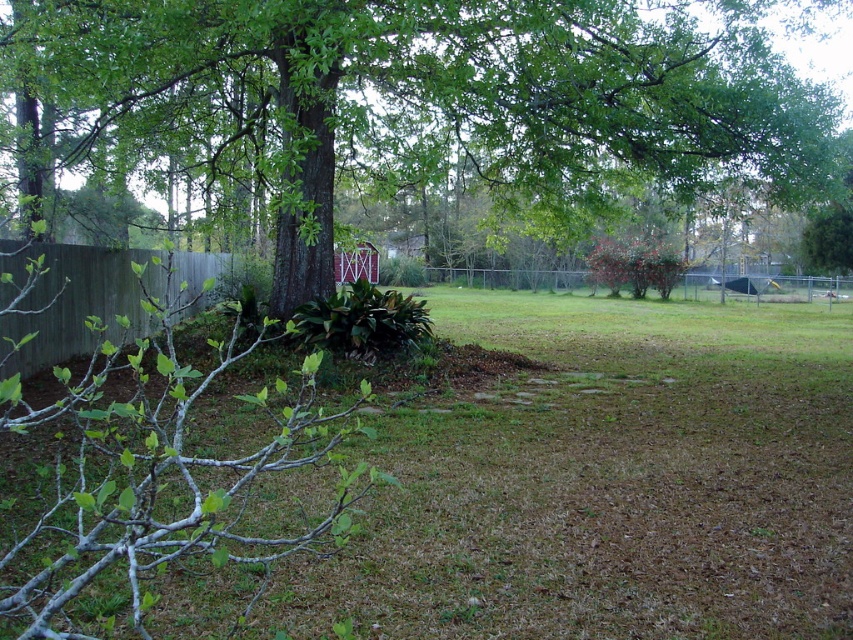
You are standing at the point labeled point (795,106) and want to walk to the shed. How far will you have to walk?

The distance between the point labeled point (795,106) and the shed is 34.83 feet, so you will have to walk 34.83 feet to reach the shed.

You are a gardener planning to mow the green grass at lower center and trim the green leafy tree at center. Which task should you do first if you want to tackle the shorter one first?

The green grass at lower center is shorter than the green leafy tree at center, so you should mow the green grass at lower center first.